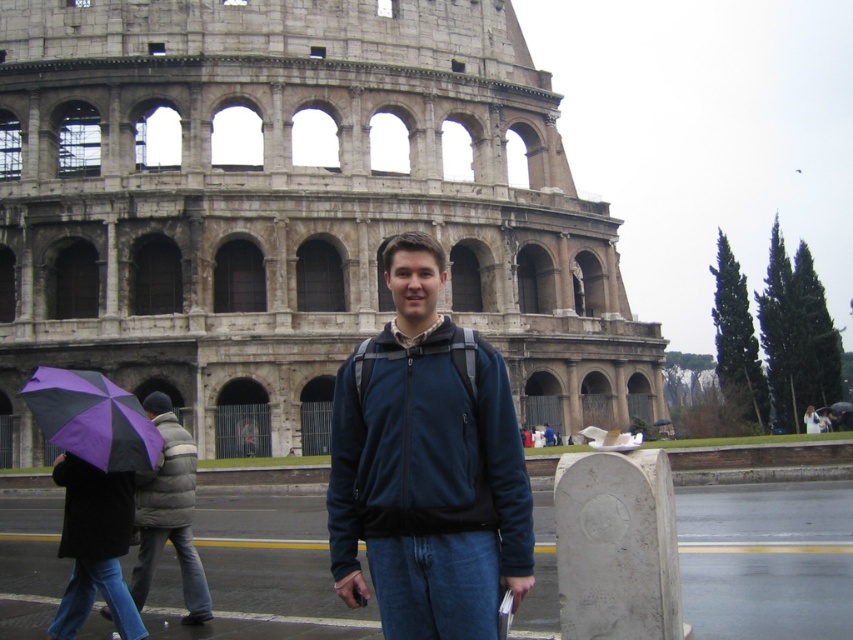
Question: Which point appears farthest from the camera in this image?

Choices:
 (A) (151, 461)
 (B) (71, 513)

Answer: (B)

Question: Which of these objects is positioned closest to the gray puffy jacket at left?

Choices:
 (A) stone amphitheater at center
 (B) dark blue fleece jacket at center

Answer: (B)

Question: Is dark blue fleece jacket at center behind gray down jacket at left?

Choices:
 (A) yes
 (B) no

Answer: (B)

Question: Estimate the real-world distances between objects in this image. Which object is farther from the gray down jacket at left?

Choices:
 (A) stone amphitheater at center
 (B) purple fabric umbrella at left

Answer: (A)

Question: Does stone amphitheater at center have a greater width compared to dark blue fleece jacket at center?

Choices:
 (A) no
 (B) yes

Answer: (B)

Question: Is dark blue fleece jacket at center positioned before dark gray fleece sweatshirt at lower left?

Choices:
 (A) no
 (B) yes

Answer: (B)